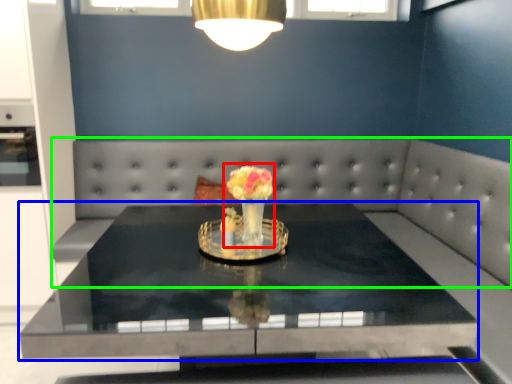
Question: Which object is the farthest from floral arrangement (highlighted by a red box)? Choose among these: table (highlighted by a blue box) or couch (highlighted by a green box).

Choices:
 (A) table
 (B) couch

Answer: (B)